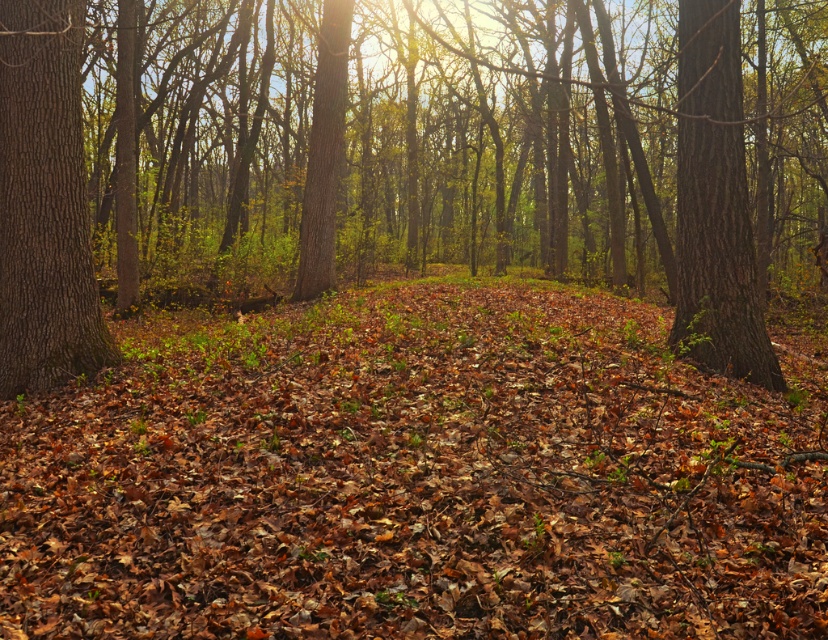
How much distance is there between brown leaf litter at center and smooth brown tree trunk at left?

brown leaf litter at center is 2.77 meters away from smooth brown tree trunk at left.

Does brown leaf litter at center appear on the right side of smooth brown tree trunk at left?

Correct, you'll find brown leaf litter at center to the right of smooth brown tree trunk at left.

I want to click on brown leaf litter at center, so click(414, 476).

Is brown rough tree trunk at center bigger than smooth brown tree trunk at center-right?

Indeed, brown rough tree trunk at center has a larger size compared to smooth brown tree trunk at center-right.

Who is more distant from viewer, [734,355] or [733,150]?

The point [733,150] is behind.

At what (x,y) coordinates should I click in order to perform the action: click on brown rough tree trunk at center. Please return your answer as a coordinate pair (x, y). Looking at the image, I should click on (403, 157).

Where is `brown rough tree trunk at center`? This screenshot has height=640, width=828. brown rough tree trunk at center is located at coordinates (403, 157).

Consider the image. Is brown leaf litter at center shorter than brown rough tree trunk at center?

Yes, brown leaf litter at center is shorter than brown rough tree trunk at center.

Between brown leaf litter at center and brown rough tree trunk at center, which one has more height?

With more height is brown rough tree trunk at center.

Where is `brown leaf litter at center`? The height and width of the screenshot is (640, 828). brown leaf litter at center is located at coordinates (414, 476).